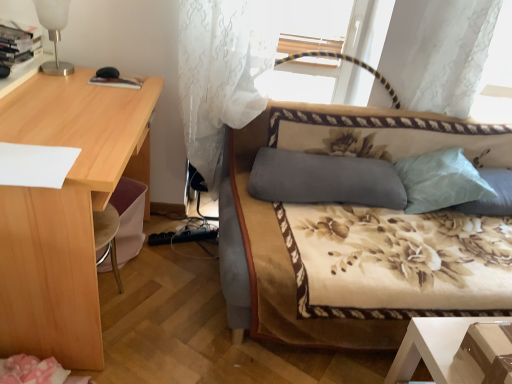
Question: Do you think white frosted glass table lamp at upper left is within white sheer curtain at center, or outside of it?

Choices:
 (A) inside
 (B) outside

Answer: (B)

Question: From their relative heights in the image, would you say white frosted glass table lamp at upper left is taller or shorter than white sheer curtain at center?

Choices:
 (A) short
 (B) tall

Answer: (A)

Question: Based on their relative distances, which object is nearer to the white frosted glass table lamp at upper left?

Choices:
 (A) light wood desk at left
 (B) light blue textured pillow at upper right, the second pillow in the left-to-right sequence
 (C) light blue fabric pillow at right, which ranks as the first pillow in right-to-left order
 (D) gray fabric pillow at center, which is the 1th pillow in left-to-right order
 (E) white sheer curtain at center

Answer: (A)

Question: Considering the real-world distances, which object is closest to the white sheer curtain at center?

Choices:
 (A) light wood desk at left
 (B) floral-patterned fabric couch at center
 (C) light blue textured pillow at upper right, the second pillow in the left-to-right sequence
 (D) gray fabric pillow at center, which is counted as the 3th pillow, starting from the right
 (E) white frosted glass table lamp at upper left

Answer: (B)